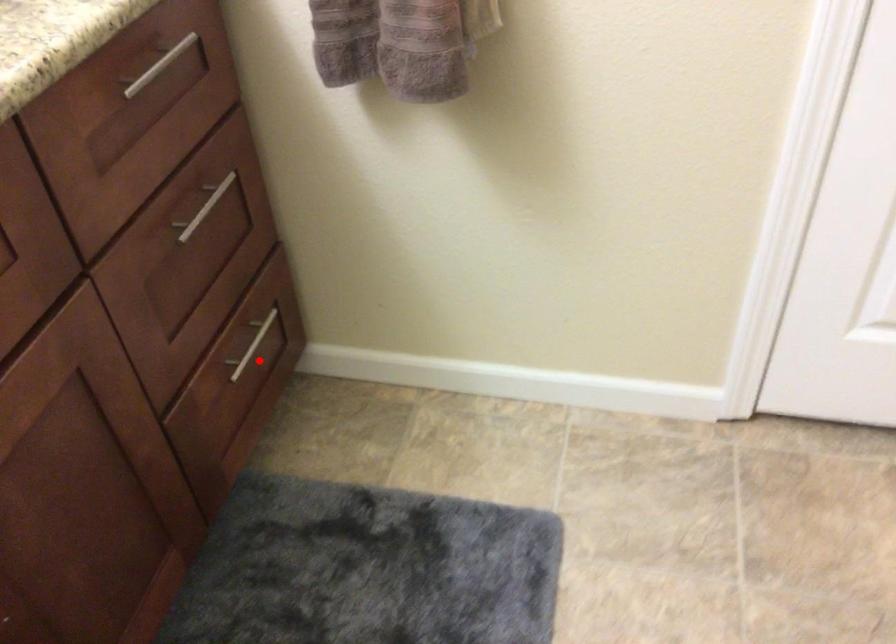
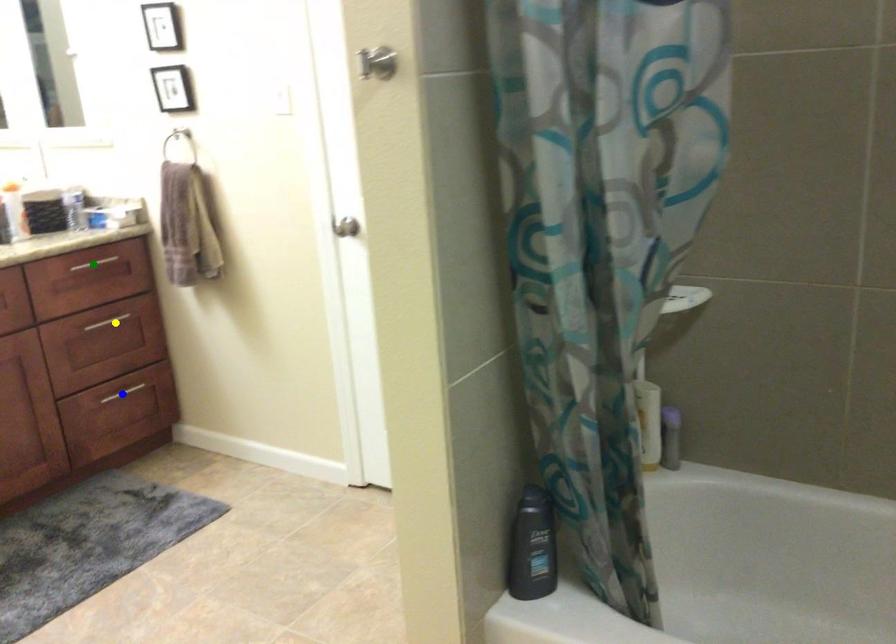
Question: I am providing you with two images of the same scene from different viewpoints. A red point is marked on the first image. You are given multiple points on the second image. In image 2, which mark is for the same physical point as the one in image 1?

Choices:
 (A) blue point
 (B) yellow point
 (C) green point

Answer: (A)